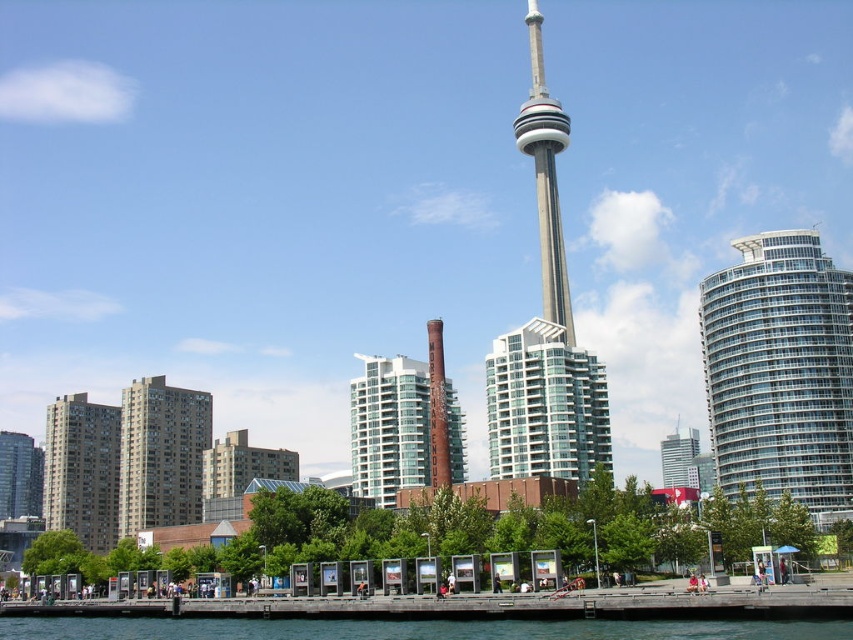
Question: Which of the following is the farthest from the observer?

Choices:
 (A) matte glass building at left
 (B) glassy steel skyscraper at center
 (C) clear water at lower center
 (D) glassy concrete building at left

Answer: (B)

Question: Can you confirm if clear glass skyscraper at right is positioned below glassy white building at center?

Choices:
 (A) yes
 (B) no

Answer: (B)

Question: Which of the following is the farthest from the observer?

Choices:
 (A) brick building at center
 (B) glassy white building at center
 (C) beige concrete high-rise at left
 (D) matte glass building at left

Answer: (D)

Question: Can you confirm if clear glass skyscraper at right is positioned to the left of clear water at lower center?

Choices:
 (A) no
 (B) yes

Answer: (A)

Question: Which of these objects is positioned closest to the matte glass building at left?

Choices:
 (A) clear water at lower center
 (B) clear glass skyscraper at right

Answer: (A)

Question: From the image, what is the correct spatial relationship of glassy white building at center in relation to brick building at center?

Choices:
 (A) left
 (B) right

Answer: (B)